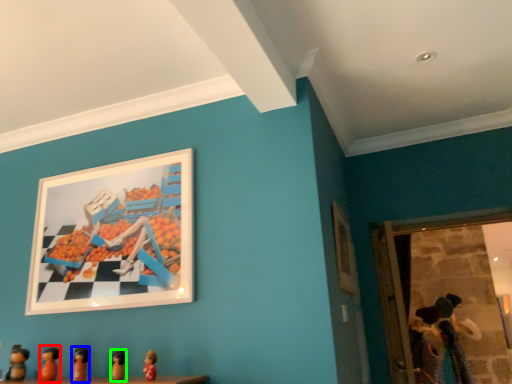
Question: Which is nearer to the toy (highlighted by a red box)? toy (highlighted by a blue box) or toy (highlighted by a green box).

Choices:
 (A) toy
 (B) toy

Answer: (A)